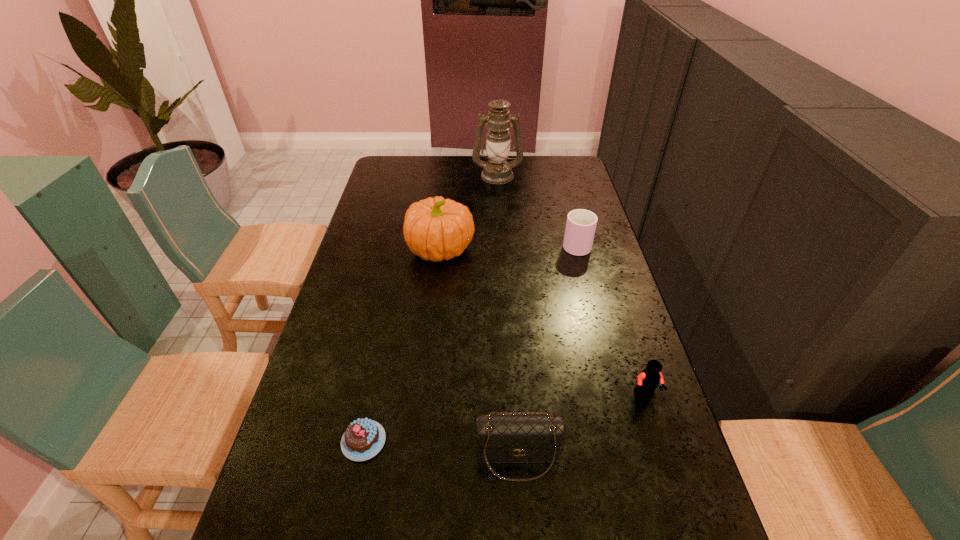
The image size is (960, 540). I want to click on object that stands as the third closest to the cup, so click(x=649, y=379).

Choose which object is the fourth nearest neighbor to the chocolate cake. Please provide its 2D coordinates. Your answer should be formatted as a tuple, i.e. [(x, y)], where the tuple contains the x and y coordinates of a point satisfying the conditions above.

[(581, 224)]